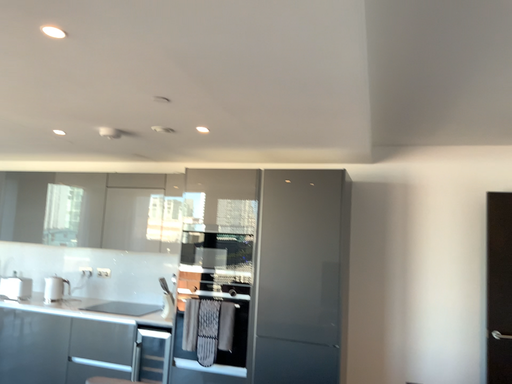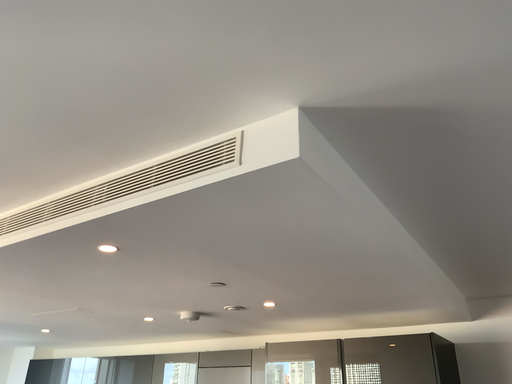
Question: How did the camera likely rotate when shooting the video?

Choices:
 (A) rotated upward
 (B) rotated downward

Answer: (A)